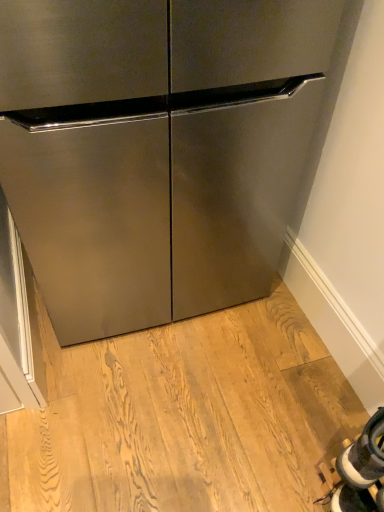
Question: From a real-world perspective, is stainless steel refrigerator at center physically located above or below white fabric shoe at lower right?

Choices:
 (A) below
 (B) above

Answer: (B)

Question: Considering the positions of stainless steel refrigerator at center and white fabric shoe at lower right in the image, is stainless steel refrigerator at center wider or thinner than white fabric shoe at lower right?

Choices:
 (A) thin
 (B) wide

Answer: (B)

Question: Would you say stainless steel refrigerator at center is inside or outside white fabric shoe at lower right?

Choices:
 (A) outside
 (B) inside

Answer: (A)

Question: Is white fabric shoe at lower right wider or thinner than stainless steel refrigerator at center?

Choices:
 (A) wide
 (B) thin

Answer: (B)

Question: From the image's perspective, relative to stainless steel refrigerator at center, is white fabric shoe at lower right above or below?

Choices:
 (A) below
 (B) above

Answer: (A)

Question: In terms of size, does white fabric shoe at lower right appear bigger or smaller than stainless steel refrigerator at center?

Choices:
 (A) small
 (B) big

Answer: (A)

Question: Considering the positions of white fabric shoe at lower right and stainless steel refrigerator at center in the image, is white fabric shoe at lower right taller or shorter than stainless steel refrigerator at center?

Choices:
 (A) tall
 (B) short

Answer: (B)